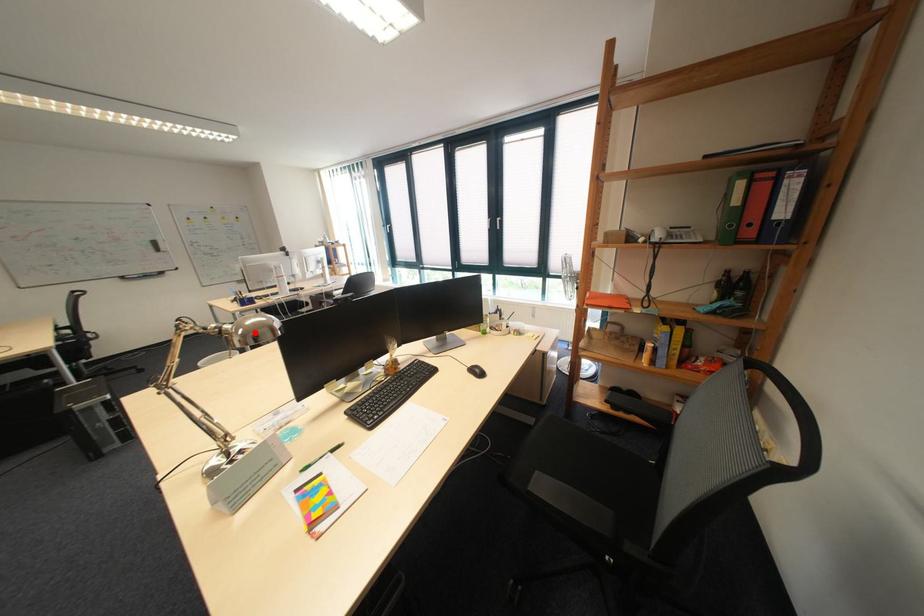
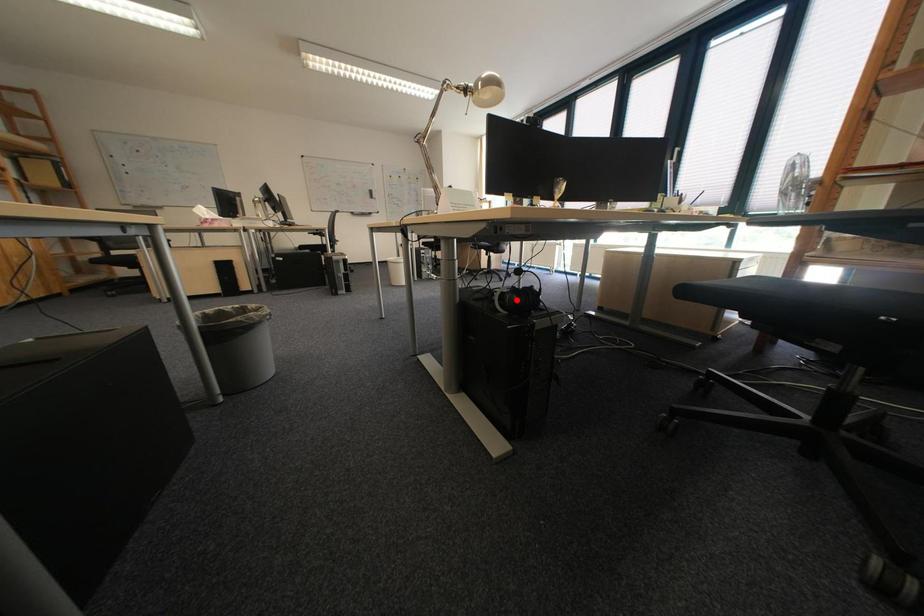
I am providing you with two images of the same scene from different viewpoints. A red point is marked on the first image and another point is marked on the second image. Do the highlighted points in image1 and image2 indicate the same real-world spot?

No